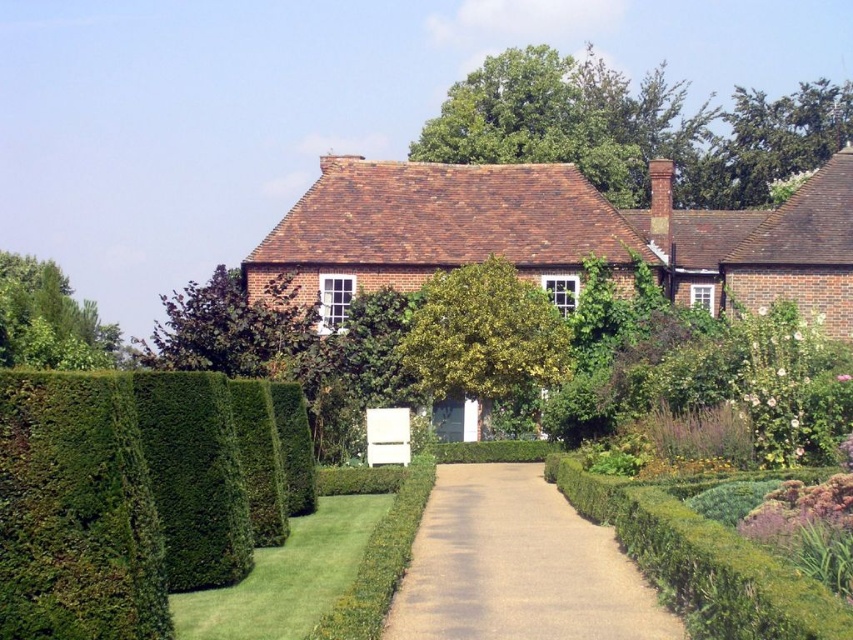
Question: Which object is closer to the camera taking this photo?

Choices:
 (A) green leafy tree at left
 (B) green leafy tree at upper center

Answer: (A)

Question: Which point is closer to the camera?

Choices:
 (A) green leafy tree at left
 (B) green leafy hedge at left

Answer: (B)

Question: Is green leafy hedge at left above green leafy tree at left?

Choices:
 (A) yes
 (B) no

Answer: (B)

Question: Can you confirm if green leafy tree at upper center is wider than purple leafy tree at center?

Choices:
 (A) no
 (B) yes

Answer: (B)

Question: Can you confirm if green leafy hedge at left is wider than green leafy tree at center?

Choices:
 (A) no
 (B) yes

Answer: (A)

Question: Which of the following is the closest to the observer?

Choices:
 (A) brown gravel driveway at center
 (B) purple leafy tree at center

Answer: (A)